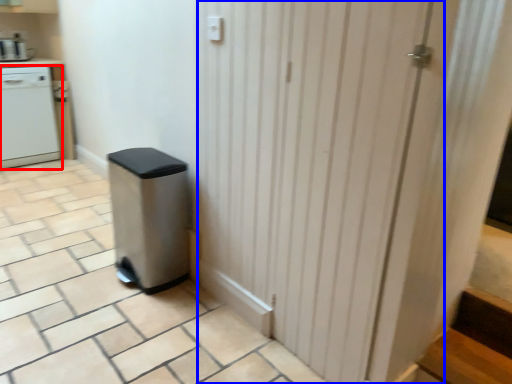
Question: Which object appears farthest to the camera in this image, home appliance (highlighted by a red box) or screen door (highlighted by a blue box)?

Choices:
 (A) home appliance
 (B) screen door

Answer: (A)